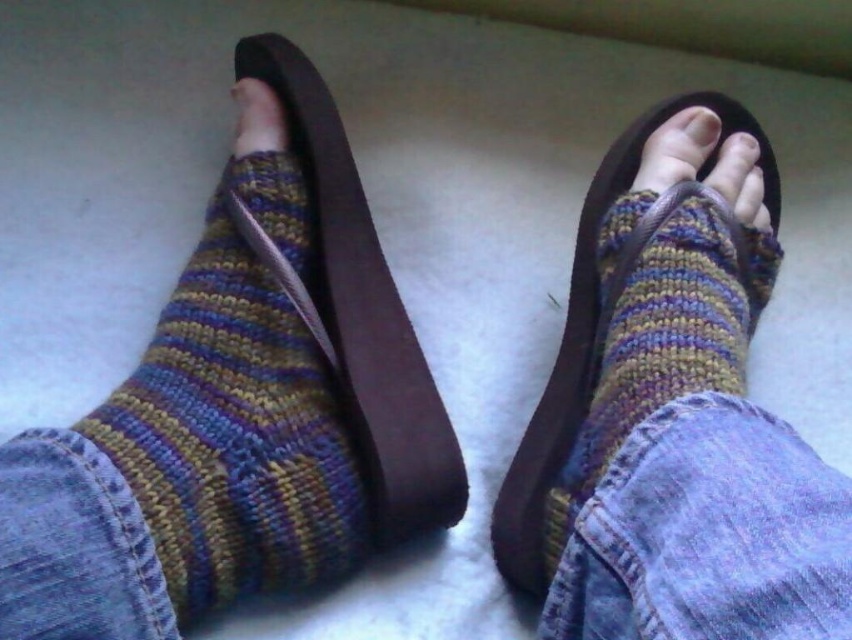
Between knitted wool sock at center and matte brown toe at center, which one appears on the right side from the viewer's perspective?

matte brown toe at center is more to the right.

In the scene shown: Does knitted wool sock at center have a greater width compared to matte brown toe at center?

Yes.

Identify the location of knitted wool sock at center. The width and height of the screenshot is (852, 640). (589, 340).

Where is `knitted wool sock at center`? This screenshot has width=852, height=640. knitted wool sock at center is located at coordinates (589, 340).

Who is more distant from viewer, (723,180) or (712,138)?

Point (712,138)

Who is more forward, (751, 150) or (704, 108)?

Point (704, 108) is in front.

Where is `matte brown leather toe at center`? The height and width of the screenshot is (640, 852). matte brown leather toe at center is located at coordinates (741, 186).

Where is `multicolored knitted sock at left`? multicolored knitted sock at left is located at coordinates (239, 417).

You are a GUI agent. You are given a task and a screenshot of the screen. Output one action in this format:
    pyautogui.click(x=<x>, y=<y>)
    Task: Click on the multicolored knitted sock at left
    The height and width of the screenshot is (640, 852).
    Given the screenshot: What is the action you would take?
    pyautogui.click(x=239, y=417)

The height and width of the screenshot is (640, 852). I want to click on multicolored knitted sock at left, so click(x=239, y=417).